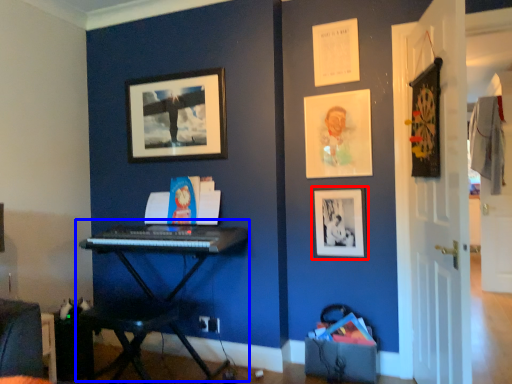
Question: Which of the following is the farthest to the observer, picture frame (highlighted by a red box) or piano (highlighted by a blue box)?

Choices:
 (A) picture frame
 (B) piano

Answer: (A)